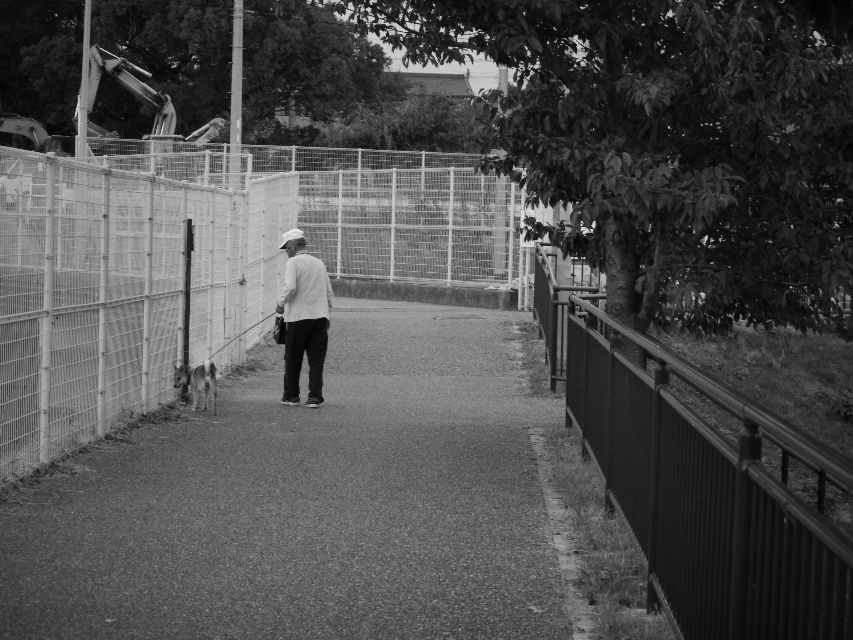
You are standing on the paved pathway and want to take a photo of the metallic wire mesh fence at left and the white matte shirt at center. Which object should you focus on first to ensure both are in sharp focus?

You should focus on the metallic wire mesh fence at left first because it is closer to you than the white matte shirt at center, so adjusting focus from near to far will help both be in focus.

You are standing at the point with coordinates point (144,237) and want to walk towards the point with coordinates point (262,502). Which direction should you move in relative to the path?

Since point (262,502) is closer to the viewer than point (144,237), you should move forward along the path towards the point (262,502).

You are a photographer trying to capture a photo of the metallic wire mesh fence at left and the white matte shirt at center. Based on their positions, which object should you focus on first if you want to include both in the same frame without moving the camera?

The metallic wire mesh fence at left is to the left of the white matte shirt at center, so you should focus on the metallic wire mesh fence at left first to ensure both are in the frame.